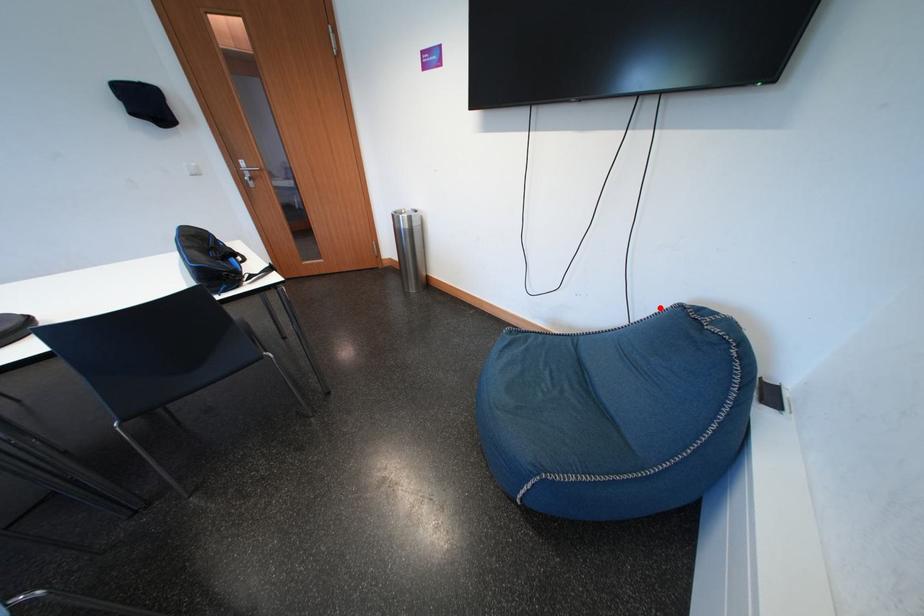
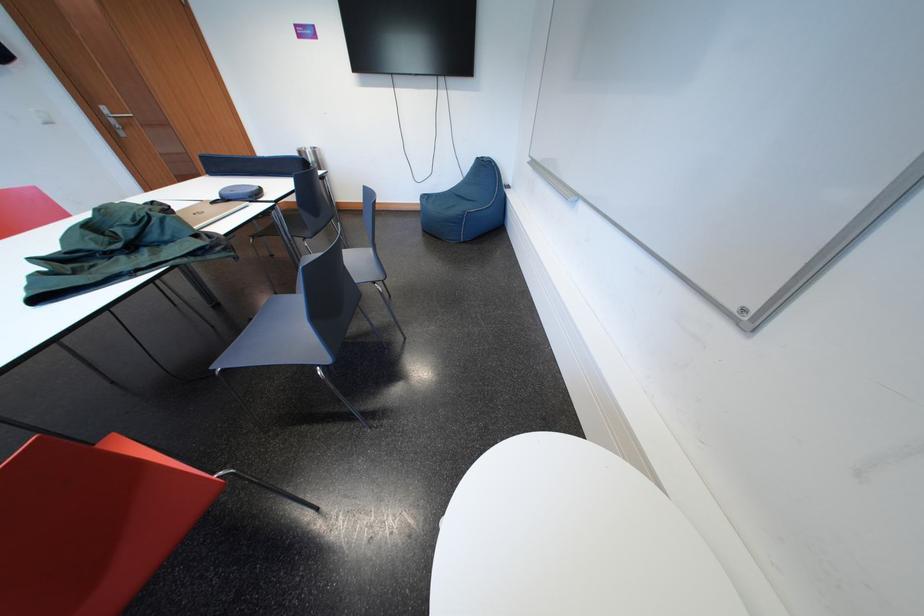
Question: I am providing you with two images of the same scene from different viewpoints. A red point is marked on the first image. At the location where the point appears in image 1, is it still visible in image 2?

Choices:
 (A) Yes
 (B) No

Answer: (A)